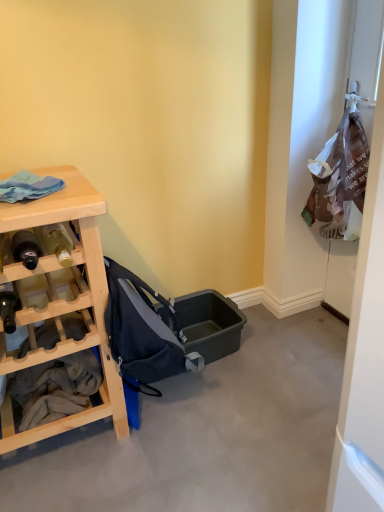
Where is `vacant space underneath dark blue fabric baby carriage at center (from a real-world perspective)`? vacant space underneath dark blue fabric baby carriage at center (from a real-world perspective) is located at coordinates (172, 409).